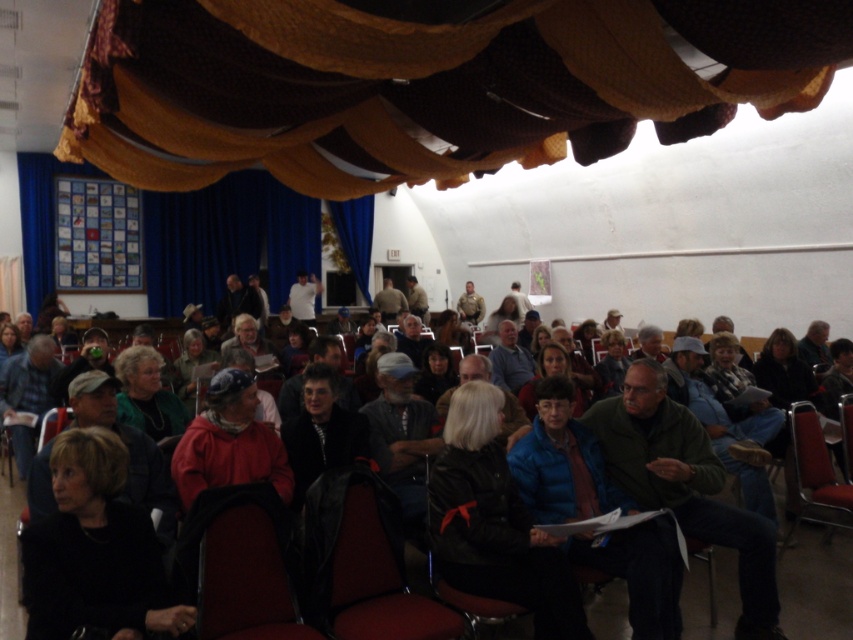
Who is shorter, black fabric jacket at lower left or green fabric jacket at center?

green fabric jacket at center is shorter.

How far apart are black fabric jacket at lower left and green fabric jacket at center?

black fabric jacket at lower left is 4.61 feet from green fabric jacket at center.

Between point (97, 625) and point (144, 352), which one is positioned in front?

Point (97, 625)

You are a GUI agent. You are given a task and a screenshot of the screen. Output one action in this format:
    pyautogui.click(x=<x>, y=<y>)
    Task: Click on the black fabric jacket at lower left
    
    Given the screenshot: What is the action you would take?
    pyautogui.click(x=96, y=548)

Identify the location of black leather jacket at center. Image resolution: width=853 pixels, height=640 pixels. (494, 522).

How far apart are black leather jacket at center and blue plaid shirt at center?

4.05 meters

At what (x,y) coordinates should I click in order to perform the action: click on black leather jacket at center. Please return your answer as a coordinate pair (x, y). Looking at the image, I should click on click(494, 522).

Locate an element on the screen. This screenshot has width=853, height=640. black leather jacket at center is located at coordinates (494, 522).

From the picture: Can you confirm if black leather jacket at center is thinner than green fabric jacket at center?

No.

Does black leather jacket at center come behind green fabric jacket at center?

No.

Does point (552, 612) lie in front of point (173, 436)?

That is True.

You are a GUI agent. You are given a task and a screenshot of the screen. Output one action in this format:
    pyautogui.click(x=<x>, y=<y>)
    Task: Click on the black leather jacket at center
    The width and height of the screenshot is (853, 640).
    Given the screenshot: What is the action you would take?
    pyautogui.click(x=494, y=522)